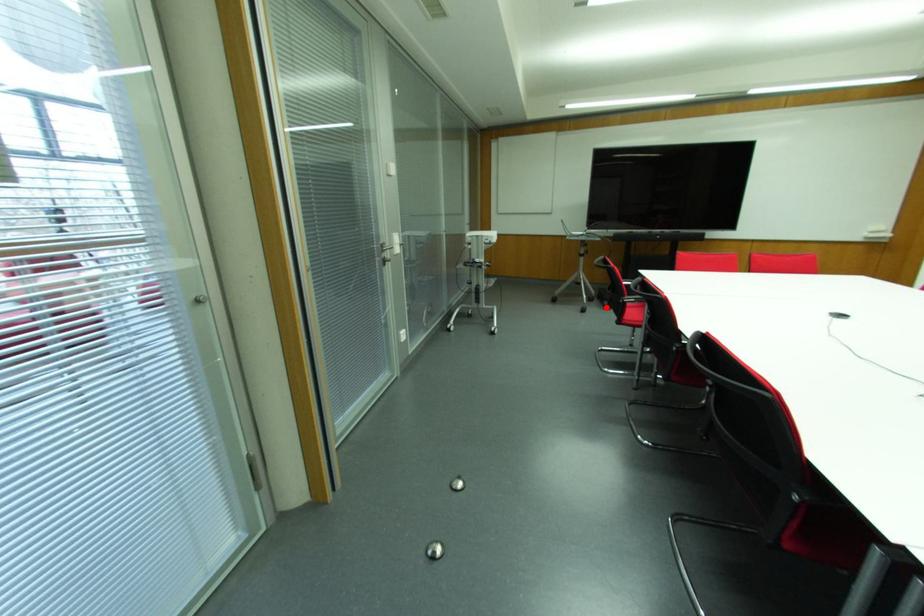
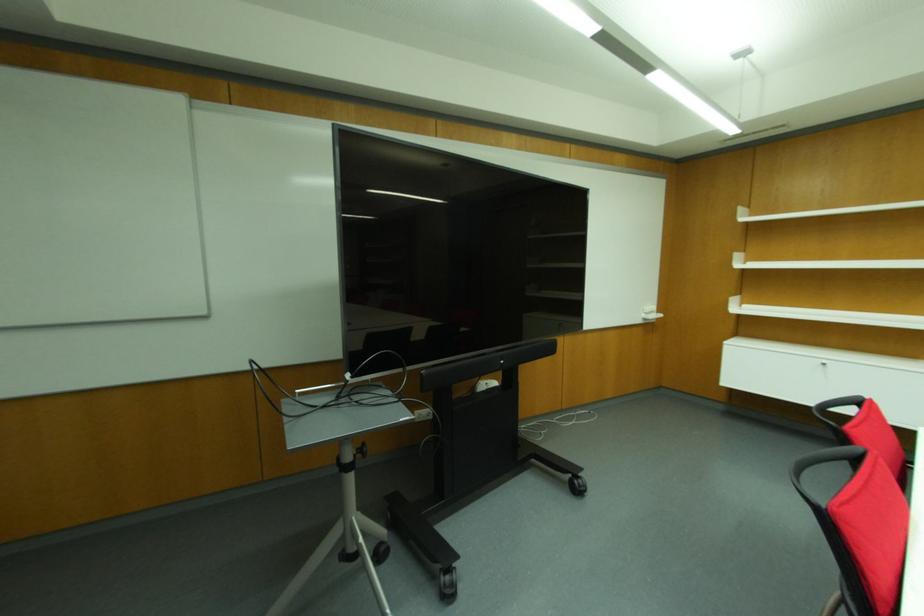
In the second image, find the point that corresponds to the highlighted location in the first image.

(448, 594)